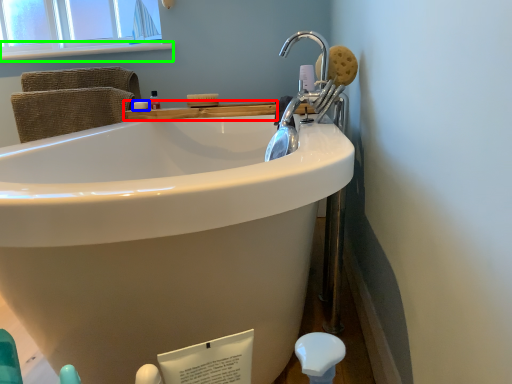
Question: Which object is the closest to the counter top (highlighted by a red box)? Choose among these: soap (highlighted by a blue box) or window sill (highlighted by a green box).

Choices:
 (A) soap
 (B) window sill

Answer: (A)